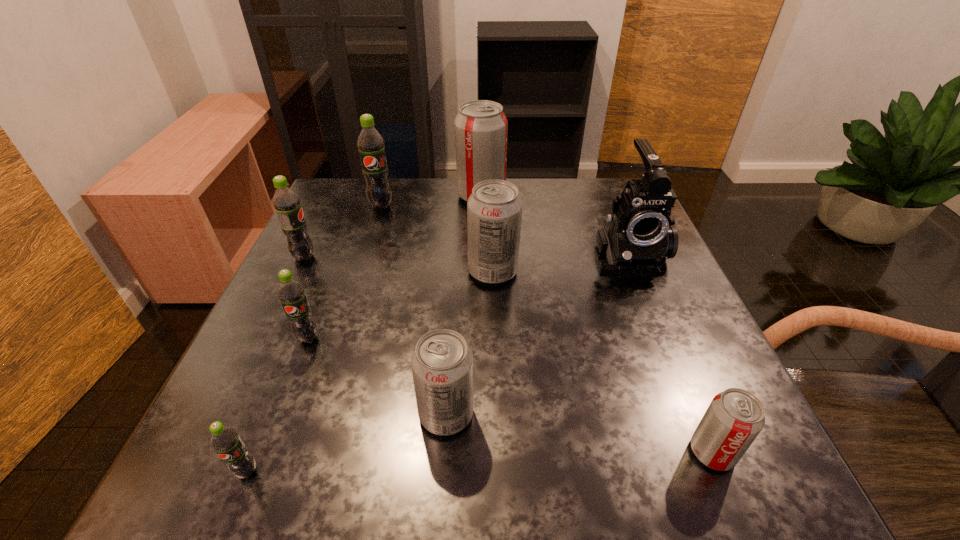
The width and height of the screenshot is (960, 540). What are the coordinates of `free space at the near left corner of the desktop` in the screenshot? It's located at (217, 485).

Find the location of a particular element. free region at the far right corner is located at coordinates (597, 194).

You are a GUI agent. You are given a task and a screenshot of the screen. Output one action in this format:
    pyautogui.click(x=<x>, y=<y>)
    Task: Click on the vacant region at the near right corner of the desktop
    Image resolution: width=960 pixels, height=540 pixels.
    Given the screenshot: What is the action you would take?
    pyautogui.click(x=661, y=451)

The width and height of the screenshot is (960, 540). In order to click on free space between the third biggest green soda and the smallest gray soda can in this screenshot , I will do `click(510, 395)`.

Find the location of a particular element. empty space that is in between the second biggest green soda and the smallest green soda is located at coordinates (276, 364).

Image resolution: width=960 pixels, height=540 pixels. In order to click on vacant area that lies between the camcorder and the third biggest gray soda can in this screenshot , I will do `click(537, 335)`.

Image resolution: width=960 pixels, height=540 pixels. In order to click on vacant region between the third biggest gray soda can and the third nearest gray soda can in this screenshot , I will do `click(469, 343)`.

Where is `unoccupied area between the second farthest gray soda can and the third biggest gray soda can`? This screenshot has width=960, height=540. unoccupied area between the second farthest gray soda can and the third biggest gray soda can is located at coordinates (469, 343).

Where is `free space between the fourth soda can from left to right and the leftmost object`? This screenshot has height=540, width=960. free space between the fourth soda can from left to right and the leftmost object is located at coordinates (343, 231).

Identify the location of free area in between the camcorder and the second smallest gray soda can. (537, 335).